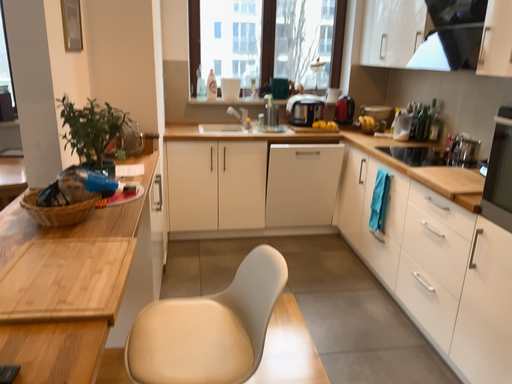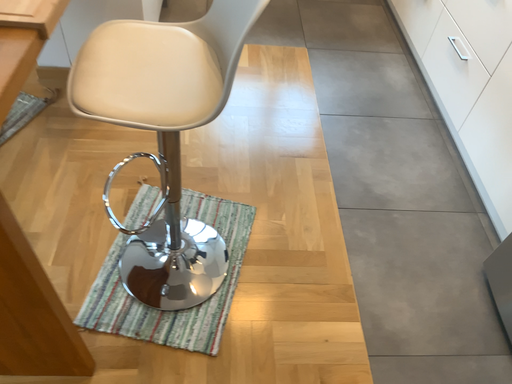
Question: How did the camera likely rotate when shooting the video?

Choices:
 (A) rotated upward
 (B) rotated downward

Answer: (B)